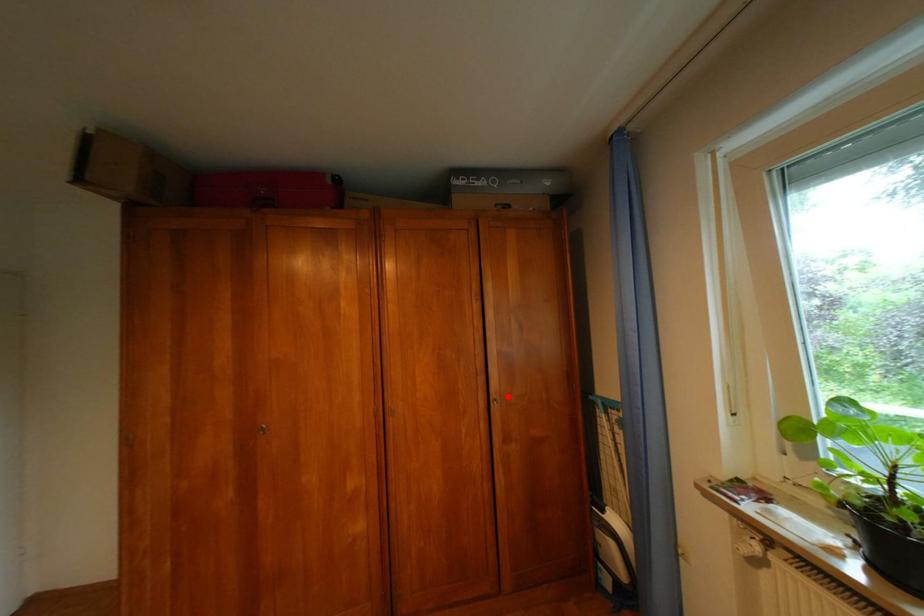
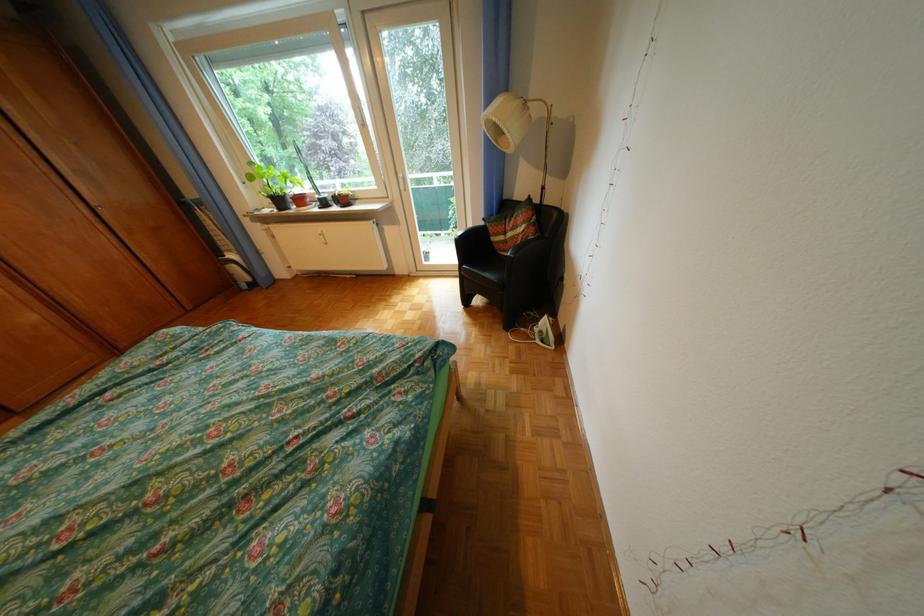
Where in the second image is the point corresponding to the highlighted location from the first image?

(110, 205)